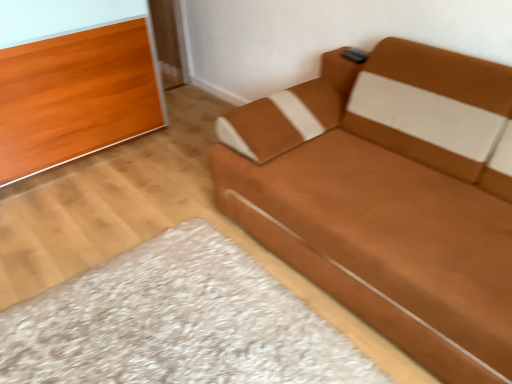
The height and width of the screenshot is (384, 512). Describe the element at coordinates (389, 197) in the screenshot. I see `suede-like brown couch at upper right` at that location.

Measure the distance between suede-like brown couch at upper right and camera.

A distance of 1.18 meters exists between suede-like brown couch at upper right and camera.

Find the location of a particular element. This screenshot has width=512, height=384. suede-like brown couch at upper right is located at coordinates (389, 197).

Where is `suede-like brown couch at upper right`? suede-like brown couch at upper right is located at coordinates (389, 197).